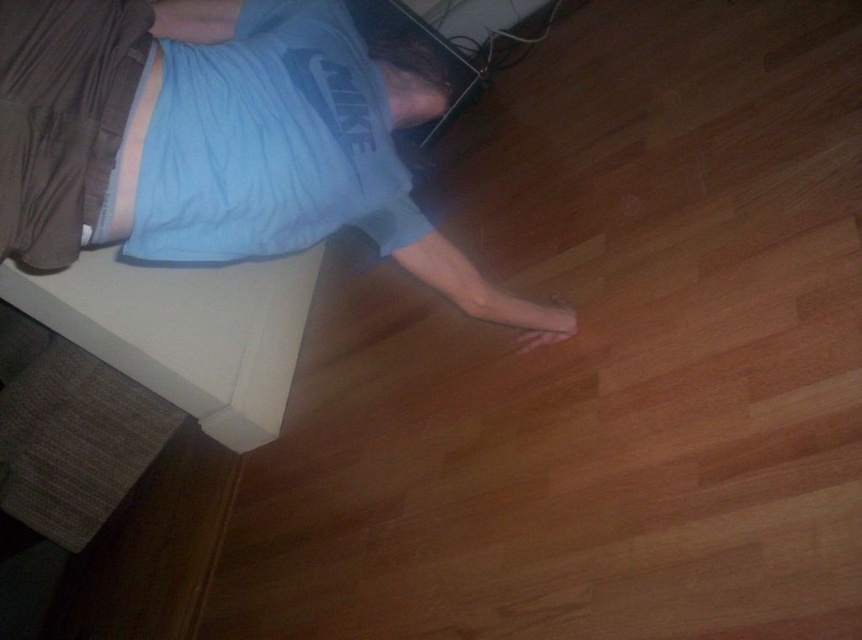
From the picture: Between blue cotton shirt at lower center and blue cotton shirt at upper left, which one appears on the left side from the viewer's perspective?

From the viewer's perspective, blue cotton shirt at upper left appears more on the left side.

Is point (116, 170) positioned before point (340, 116)?

Yes, it is in front of point (340, 116).

Where is `blue cotton shirt at lower center`? Image resolution: width=862 pixels, height=640 pixels. blue cotton shirt at lower center is located at coordinates (265, 152).